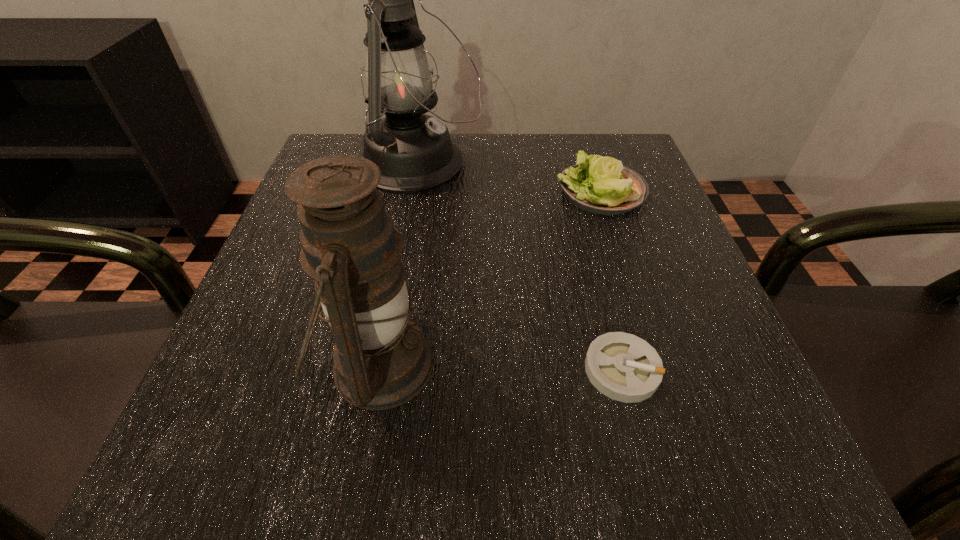
Image resolution: width=960 pixels, height=540 pixels. Identify the location of blank space at the right edge of the desktop. (637, 325).

The image size is (960, 540). In the image, there is a desktop. In order to click on blank space at the far left corner in this screenshot , I will do `click(325, 138)`.

In the image, there is a desktop. What are the coordinates of `free space at the near left corner` in the screenshot? It's located at (265, 442).

Locate an element on the screen. This screenshot has width=960, height=540. blank space at the far right corner is located at coordinates (596, 145).

The image size is (960, 540). Identify the location of empty space between the farther oil lamp and the ashtray. (520, 267).

The width and height of the screenshot is (960, 540). Identify the location of blank region between the tallest object and the lettuce. (510, 178).

Identify the location of vacant space that's between the ashtray and the third tallest object. (612, 280).

I want to click on free spot between the tallest object and the ashtray, so click(520, 267).

The width and height of the screenshot is (960, 540). I want to click on vacant region between the nearer oil lamp and the second shortest object, so click(x=490, y=278).

At what (x,y) coordinates should I click in order to perform the action: click on vacant space that is in between the shortest object and the nearer oil lamp. Please return your answer as a coordinate pair (x, y). Looking at the image, I should click on (500, 367).